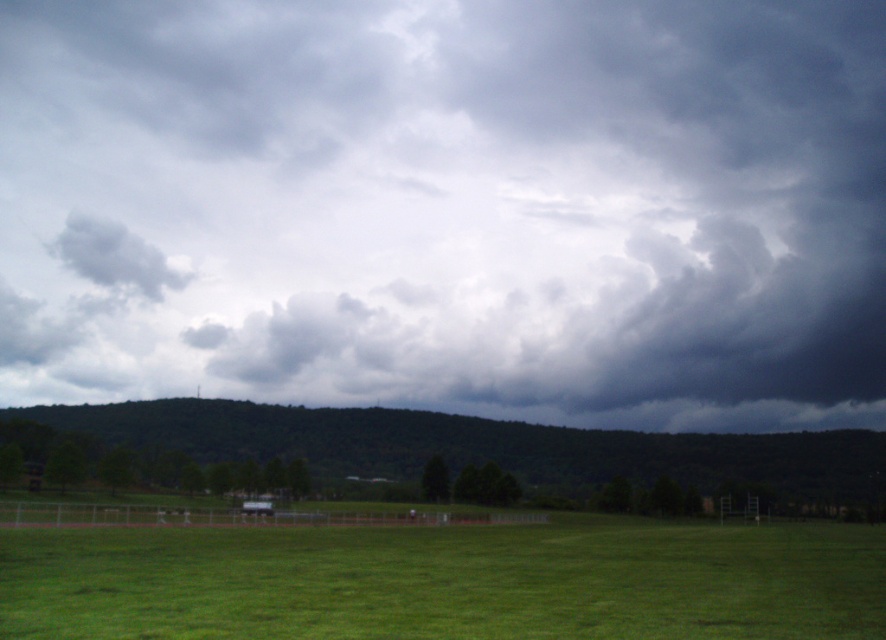
This screenshot has height=640, width=886. What do you see at coordinates (447, 580) in the screenshot? I see `green grassy field at lower center` at bounding box center [447, 580].

Does green grassy field at lower center have a smaller size compared to green grass at lower center?

Indeed, green grassy field at lower center has a smaller size compared to green grass at lower center.

Who is more forward, (781, 579) or (828, 460)?

Point (781, 579) is more forward.

This screenshot has width=886, height=640. In order to click on green grassy field at lower center in this screenshot , I will do `click(447, 580)`.

Between dark gray cloud at center and green grass at lower center, which one has more height?

dark gray cloud at center

Is dark gray cloud at center smaller than green grass at lower center?

No, dark gray cloud at center is not smaller than green grass at lower center.

Is point (659, 100) positioned before point (222, 438)?

No, (659, 100) is further to viewer.

You are a GUI agent. You are given a task and a screenshot of the screen. Output one action in this format:
    pyautogui.click(x=<x>, y=<y>)
    Task: Click on the dark gray cloud at center
    
    Given the screenshot: What is the action you would take?
    pyautogui.click(x=455, y=205)

Can you confirm if green grassy field at lower center is wider than gray fluffy cloud at upper left?

A: Yes, green grassy field at lower center is wider than gray fluffy cloud at upper left.

Does green grassy field at lower center have a larger size compared to gray fluffy cloud at upper left?

Yes, green grassy field at lower center is bigger than gray fluffy cloud at upper left.

Describe the element at coordinates (447, 580) in the screenshot. I see `green grassy field at lower center` at that location.

This screenshot has height=640, width=886. What are the coordinates of `green grassy field at lower center` in the screenshot? It's located at (447, 580).